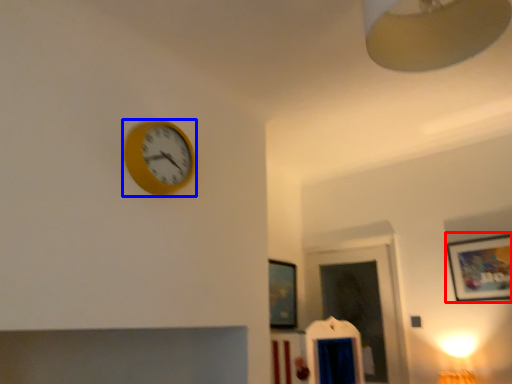
Question: Which of the following is the closest to the observer, picture frame (highlighted by a red box) or wall clock (highlighted by a blue box)?

Choices:
 (A) picture frame
 (B) wall clock

Answer: (B)